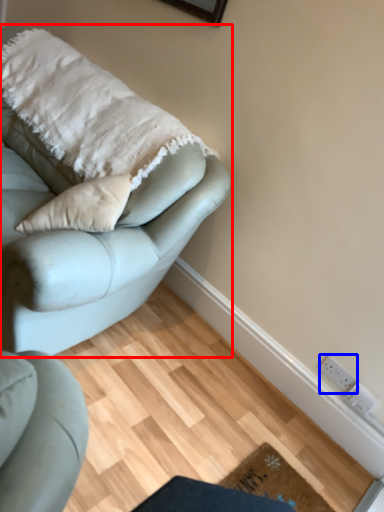
Question: Which of the following is the closest to the observer, studio couch (highlighted by a red box) or electric outlet (highlighted by a blue box)?

Choices:
 (A) studio couch
 (B) electric outlet

Answer: (A)